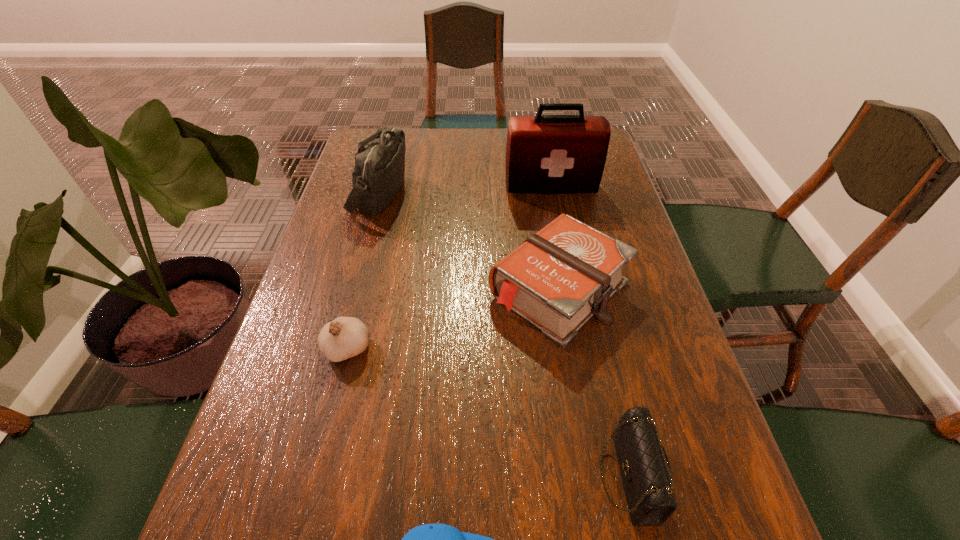
In order to click on vacant space located on the front flap of the fifth farthest object in this screenshot , I will do `click(530, 477)`.

Locate an element on the screen. The height and width of the screenshot is (540, 960). blank space located 0.290m on the front of the garlic is located at coordinates (300, 532).

This screenshot has height=540, width=960. I want to click on shoulder bag located at the left edge, so click(x=378, y=174).

The width and height of the screenshot is (960, 540). In order to click on garlic located at the left edge in this screenshot , I will do `click(345, 337)`.

Locate an element on the screen. the first aid kit positioned at the right edge is located at coordinates (545, 154).

The image size is (960, 540). What are the coordinates of `Bible that is at the right edge` in the screenshot? It's located at (557, 279).

Locate an element on the screen. This screenshot has height=540, width=960. clutch bag at the right edge is located at coordinates (645, 471).

At what (x,y) coordinates should I click in order to perform the action: click on free space at the far edge. Please return your answer as a coordinate pair (x, y). Looking at the image, I should click on (407, 141).

The height and width of the screenshot is (540, 960). I want to click on free spot at the left edge of the desktop, so click(x=339, y=363).

Where is `free location at the right edge of the desktop`? The image size is (960, 540). free location at the right edge of the desktop is located at coordinates [624, 295].